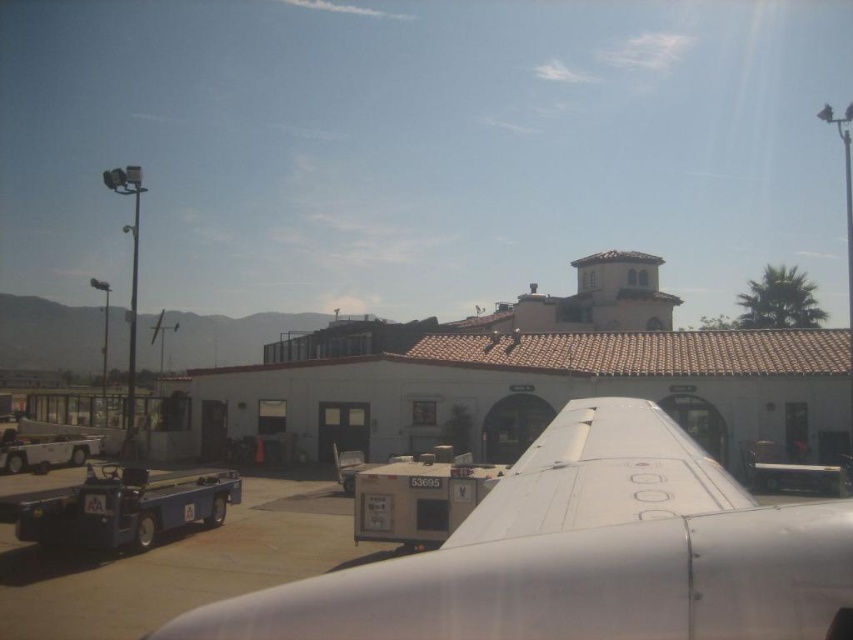
You are a pilot preparing for takeoff and need to ensure there is enough space between the white matte airplane wing at center and the smooth gray tarmac at lower left. Based on the scene, can you determine which one is wider?

The white matte airplane wing at center is wider than the smooth gray tarmac at lower left according to the description.

You are a maintenance worker who needs to move a 12 feet long ladder from the smooth gray tarmac at lower left to the white matte airplane wing at center. Can you safely move the ladder without bending it? Please explain your reasoning.

The distance between the white matte airplane wing at center and the smooth gray tarmac at lower left is 11.97 feet. Since the ladder is 12 feet long, it is slightly longer than the available space. Therefore, you cannot safely move the ladder without bending it.

You are a maintenance worker at the airport. You need to place a ladder that is 2 meters tall against the white matte airplane wing at center and the smooth gray tarmac at lower left. Which object will require a longer ladder to reach its highest point?

The white matte airplane wing at center is taller than the smooth gray tarmac at lower left, so the ladder placed against the white matte airplane wing at center will need to be longer to reach its highest point.